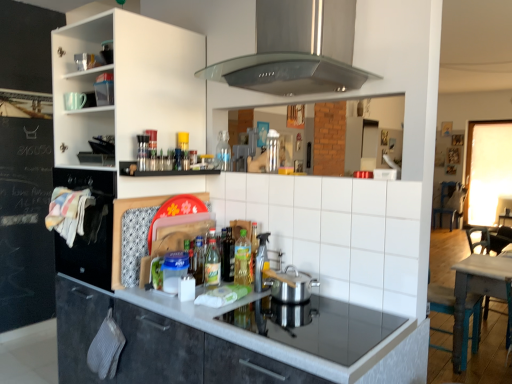
The width and height of the screenshot is (512, 384). I want to click on vacant area that is in front of translucent plastic bottles at center, positioned as the second bottle in back-to-front order, so click(188, 295).